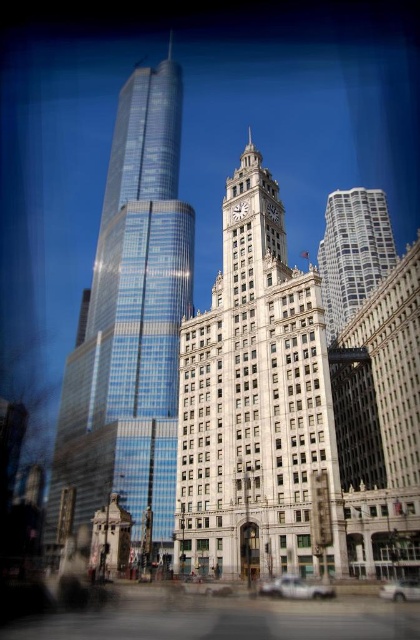
Who is taller, shiny glass skyscraper at left or white glass tower at center?

shiny glass skyscraper at left

What do you see at coordinates (130, 324) in the screenshot? I see `shiny glass skyscraper at left` at bounding box center [130, 324].

Does point (118, 394) come in front of point (349, 262)?

That is True.

The width and height of the screenshot is (420, 640). What are the coordinates of `shiny glass skyscraper at left` in the screenshot? It's located at (130, 324).

Image resolution: width=420 pixels, height=640 pixels. Describe the element at coordinates (130, 324) in the screenshot. I see `shiny glass skyscraper at left` at that location.

Does shiny glass skyscraper at left come in front of silver metallic car at lower center?

No, shiny glass skyscraper at left is behind silver metallic car at lower center.

Identify the location of shiny glass skyscraper at left. (130, 324).

Does point (136, 336) come closer to viewer compared to point (393, 588)?

No, it is not.

Looking at this image, between shiny glass skyscraper at left and white matte car at lower right, which one is positioned higher?

shiny glass skyscraper at left is higher up.

The image size is (420, 640). In order to click on shiny glass skyscraper at left in this screenshot , I will do `click(130, 324)`.